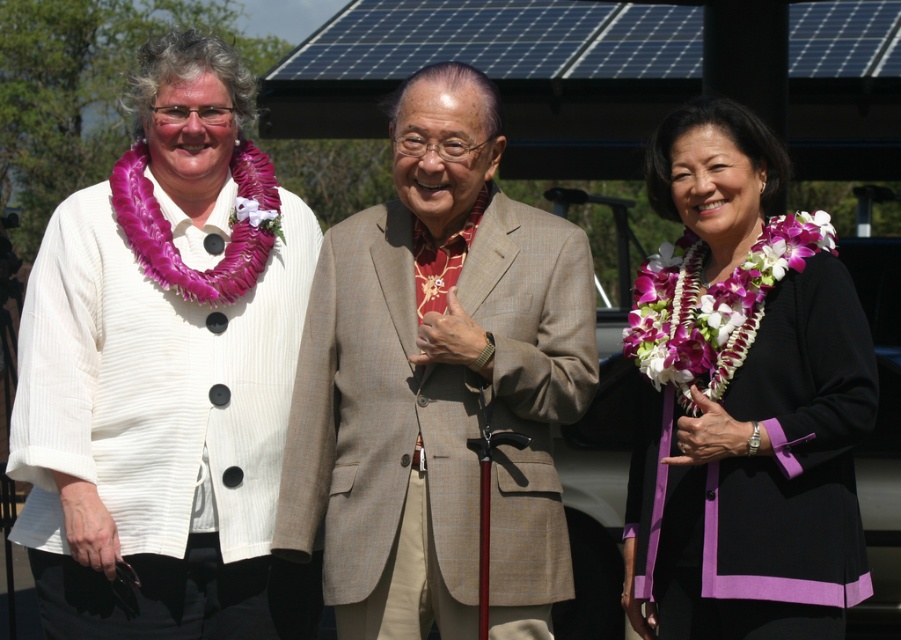
Based on the scene description, which clothing item is taller between the white textured cardigan at left and the tan textured suit at center?

The white textured cardigan at left is taller than the tan textured suit at center.

You are a photographer trying to capture a clear shot of the tan textured suit at center and the black satin blazer at center. Which one is positioned higher in the frame?

The tan textured suit at center is positioned higher in the frame than the black satin blazer at center.